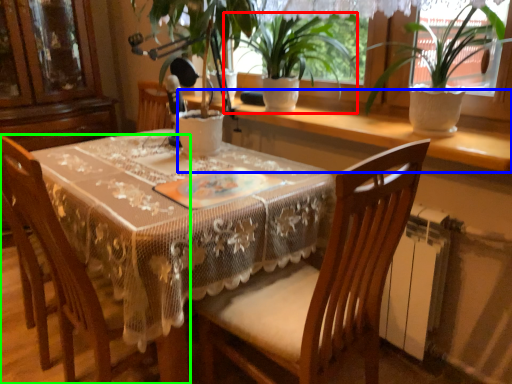
Question: Estimate the real-world distances between objects in this image. Which object is closer to houseplant (highlighted by a red box), window sill (highlighted by a blue box) or chair (highlighted by a green box)?

Choices:
 (A) window sill
 (B) chair

Answer: (A)